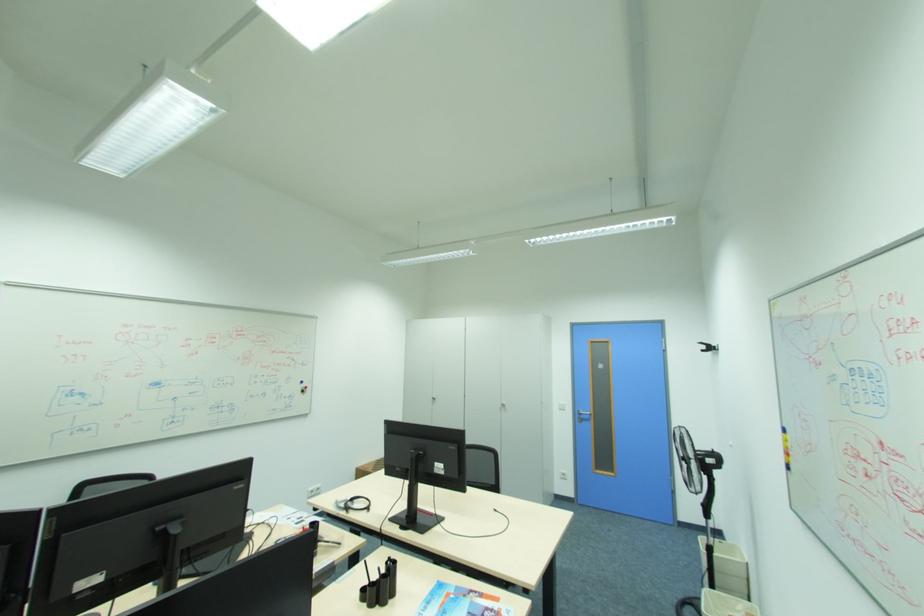
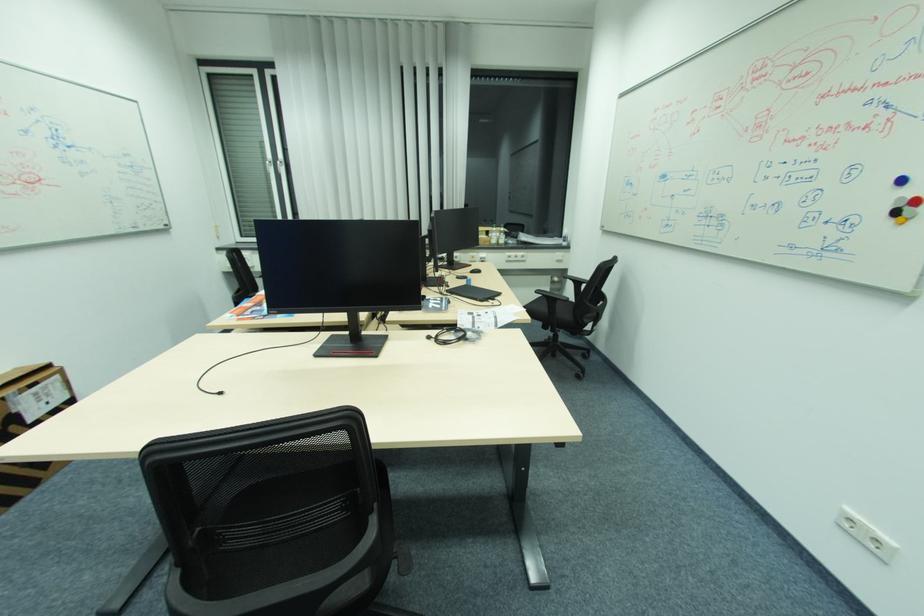
Find the pixel in the second image that matches (x=307, y=394) in the first image.

(896, 221)